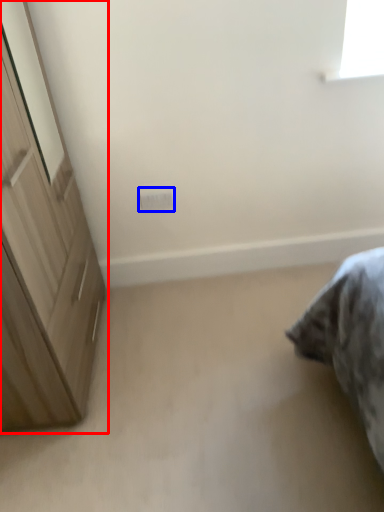
Question: Which object is closer to the camera taking this photo, cupboard (highlighted by a red box) or electric outlet (highlighted by a blue box)?

Choices:
 (A) cupboard
 (B) electric outlet

Answer: (A)